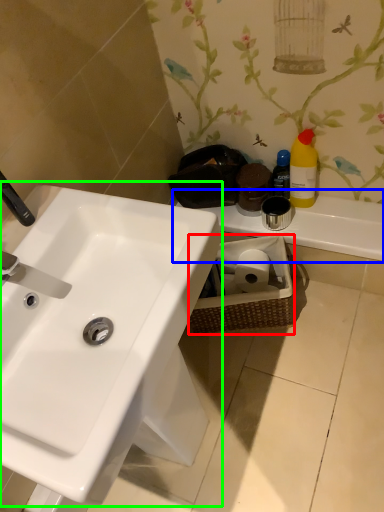
Question: Which is nearer to the basket (highlighted by a red box)? counter top (highlighted by a blue box) or sink (highlighted by a green box).

Choices:
 (A) counter top
 (B) sink

Answer: (A)